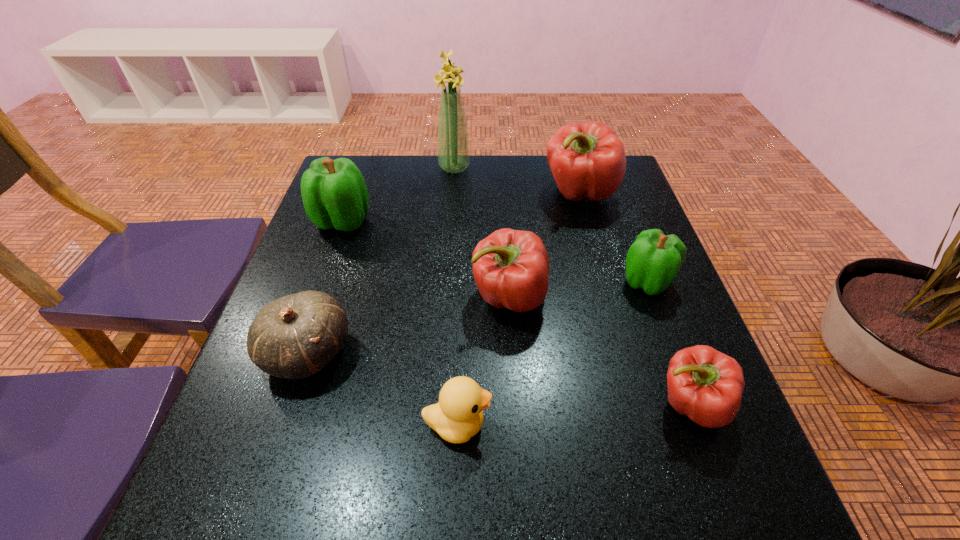
The image size is (960, 540). Identify the location of the nearest bell pepper. (704, 384).

Where is `the smallest pink bell pepper`? The height and width of the screenshot is (540, 960). the smallest pink bell pepper is located at coordinates (704, 384).

Find the location of a particular element. This screenshot has width=960, height=540. duck is located at coordinates (458, 415).

The height and width of the screenshot is (540, 960). What are the coordinates of `free region located on the front-facing side of the tallest object` in the screenshot? It's located at (507, 167).

I want to click on free space located 0.080m on the back of the farthest pink bell pepper, so click(569, 160).

Locate an element on the screen. vacant region located 0.060m on the back of the leftmost bell pepper is located at coordinates (353, 192).

In order to click on vacant region located 0.080m on the back of the leftmost pink bell pepper in this screenshot , I will do `click(507, 247)`.

This screenshot has width=960, height=540. I want to click on blank area located on the left of the smaller green bell pepper, so click(540, 282).

You are a GUI agent. You are given a task and a screenshot of the screen. Output one action in this format:
    pyautogui.click(x=<x>, y=<y>)
    Task: Click on the blank space located on the front of the gourd
    This screenshot has width=960, height=540.
    Given the screenshot: What is the action you would take?
    pyautogui.click(x=283, y=423)

What are the coordinates of `free space located 0.110m on the front of the nearest bell pepper` in the screenshot? It's located at (730, 512).